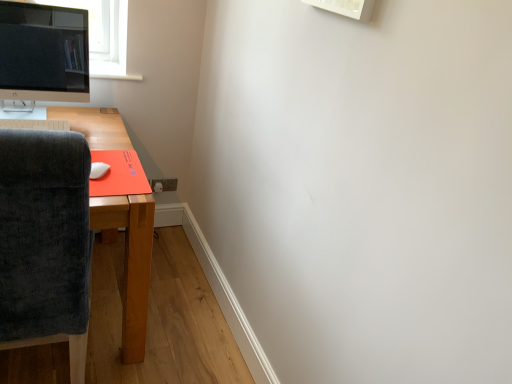
Question: Does satin black monitor at upper left appear on the right side of white plastic keyboard at lower left?

Choices:
 (A) yes
 (B) no

Answer: (A)

Question: Is satin black monitor at upper left smaller than white plastic keyboard at lower left?

Choices:
 (A) yes
 (B) no

Answer: (B)

Question: Would you say white plastic keyboard at lower left is part of satin black monitor at upper left's contents?

Choices:
 (A) no
 (B) yes

Answer: (A)

Question: Is the depth of satin black monitor at upper left less than that of white plastic keyboard at lower left?

Choices:
 (A) yes
 (B) no

Answer: (B)

Question: Is the position of satin black monitor at upper left more distant than that of white plastic keyboard at lower left?

Choices:
 (A) no
 (B) yes

Answer: (B)

Question: From a real-world perspective, is satin black monitor at upper left over white plastic keyboard at lower left?

Choices:
 (A) yes
 (B) no

Answer: (A)

Question: Does white plastic keyboard at lower left turn towards white matte mouse at lower left?

Choices:
 (A) no
 (B) yes

Answer: (B)

Question: Is white plastic keyboard at lower left at the right side of white matte mouse at lower left?

Choices:
 (A) no
 (B) yes

Answer: (A)

Question: Is white plastic keyboard at lower left positioned with its back to white matte mouse at lower left?

Choices:
 (A) no
 (B) yes

Answer: (A)

Question: From a real-world perspective, is white plastic keyboard at lower left on white matte mouse at lower left?

Choices:
 (A) yes
 (B) no

Answer: (A)

Question: Is white plastic keyboard at lower left outside white matte mouse at lower left?

Choices:
 (A) yes
 (B) no

Answer: (A)

Question: Is white plastic keyboard at lower left not close to white matte mouse at lower left?

Choices:
 (A) yes
 (B) no

Answer: (B)

Question: Is dark gray fabric chair at left looking in the opposite direction of white matte mouse at lower left?

Choices:
 (A) no
 (B) yes

Answer: (A)